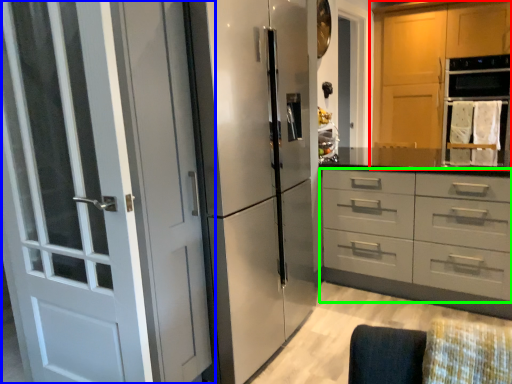
Question: Estimate the real-world distances between objects in this image. Which object is closer to cabinetry (highlighted by a red box), door (highlighted by a blue box) or drawer (highlighted by a green box)?

Choices:
 (A) door
 (B) drawer

Answer: (B)